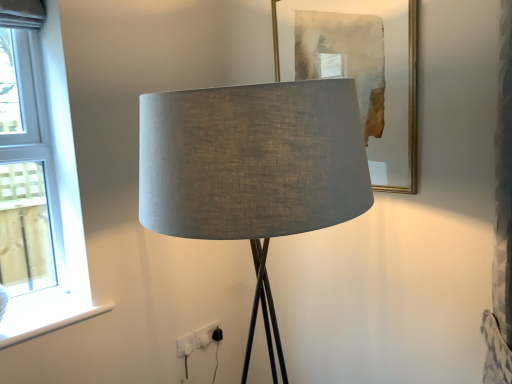
Question: Is white smooth window sill at lower left positioned in front of gold-framed mirror at upper center?

Choices:
 (A) yes
 (B) no

Answer: (B)

Question: Is white smooth window sill at lower left located outside gold-framed mirror at upper center?

Choices:
 (A) no
 (B) yes

Answer: (B)

Question: Is white smooth window sill at lower left positioned with its back to gold-framed mirror at upper center?

Choices:
 (A) yes
 (B) no

Answer: (B)

Question: Does white smooth window sill at lower left turn towards gold-framed mirror at upper center?

Choices:
 (A) yes
 (B) no

Answer: (B)

Question: Is white smooth window sill at lower left taller than gold-framed mirror at upper center?

Choices:
 (A) no
 (B) yes

Answer: (A)

Question: Which is correct: white smooth window sill at lower left is inside gold-framed mirror at upper center, or outside of it?

Choices:
 (A) inside
 (B) outside

Answer: (B)

Question: From a real-world perspective, is white smooth window sill at lower left physically located above or below gold-framed mirror at upper center?

Choices:
 (A) below
 (B) above

Answer: (A)

Question: From the image's perspective, is white smooth window sill at lower left positioned above or below gold-framed mirror at upper center?

Choices:
 (A) below
 (B) above

Answer: (A)

Question: Visually, is white smooth window sill at lower left positioned to the left or to the right of gold-framed mirror at upper center?

Choices:
 (A) right
 (B) left

Answer: (B)

Question: From their relative heights in the image, would you say white plastic electric outlet at lower center, the first electric outlet when ordered from right to left, is taller or shorter than white plastic electric outlet at lower center, acting as the 1th electric outlet starting from the front?

Choices:
 (A) short
 (B) tall

Answer: (B)

Question: Is point (211, 322) closer or farther from the camera than point (186, 350)?

Choices:
 (A) closer
 (B) farther

Answer: (B)

Question: Visually, is white plastic electric outlet at lower center, acting as the 2th electric outlet starting from the front, positioned to the left or to the right of white plastic electric outlet at lower center, which is counted as the first electric outlet, starting from the left?

Choices:
 (A) left
 (B) right

Answer: (B)

Question: Looking at the image, does white plastic electric outlet at lower center, the first electric outlet when ordered from right to left, seem bigger or smaller compared to white plastic electric outlet at lower center, acting as the 1th electric outlet starting from the front?

Choices:
 (A) small
 (B) big

Answer: (B)

Question: Relative to white plastic electric outlet at lower center, the 1th electric outlet in the back-to-front sequence, is white smooth window sill at lower left in front or behind?

Choices:
 (A) front
 (B) behind

Answer: (A)

Question: Which is correct: white smooth window sill at lower left is inside white plastic electric outlet at lower center, the 2th electric outlet positioned from the left, or outside of it?

Choices:
 (A) inside
 (B) outside

Answer: (B)